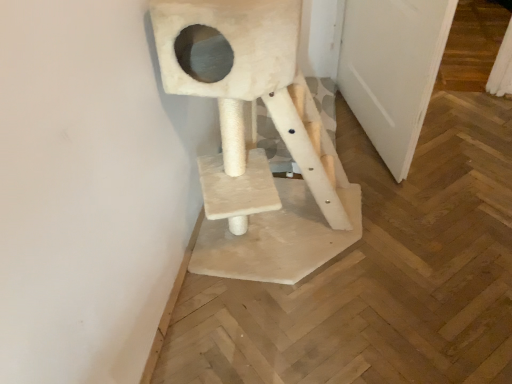
Question: Is sanded wood cat tree at center in front of or behind white matte door at right in the image?

Choices:
 (A) front
 (B) behind

Answer: (A)

Question: Based on their sizes in the image, would you say sanded wood cat tree at center is bigger or smaller than white matte door at right?

Choices:
 (A) small
 (B) big

Answer: (B)

Question: From a real-world perspective, is sanded wood cat tree at center physically located above or below white matte door at right?

Choices:
 (A) below
 (B) above

Answer: (B)

Question: Which is correct: white matte door at right is inside sanded wood cat tree at center, or outside of it?

Choices:
 (A) outside
 (B) inside

Answer: (A)

Question: Relative to sanded wood cat tree at center, is white matte door at right in front or behind?

Choices:
 (A) behind
 (B) front

Answer: (A)

Question: Is point (353, 97) positioned closer to the camera than point (290, 107)?

Choices:
 (A) farther
 (B) closer

Answer: (A)

Question: Considering the positions of white matte door at right and sanded wood cat tree at center in the image, is white matte door at right taller or shorter than sanded wood cat tree at center?

Choices:
 (A) tall
 (B) short

Answer: (B)